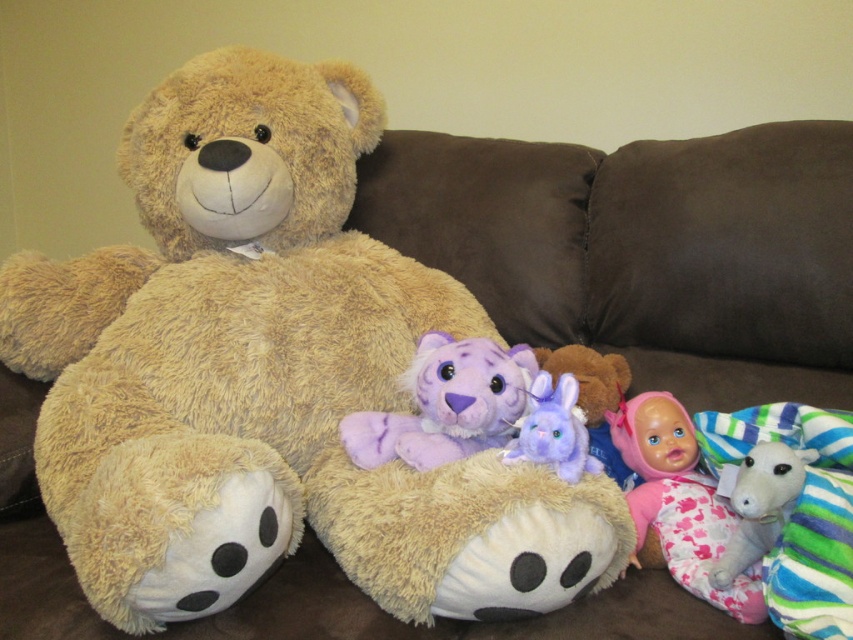
Question: Can you confirm if pink fabric doll at lower right is positioned to the right of white plush goat at lower right?

Choices:
 (A) yes
 (B) no

Answer: (B)

Question: Considering the relative positions of pink fabric doll at lower right and purple plush tiger at center in the image provided, where is pink fabric doll at lower right located with respect to purple plush tiger at center?

Choices:
 (A) above
 (B) below

Answer: (B)

Question: Is pink fabric doll at lower right wider than purple plush rabbit at center?

Choices:
 (A) no
 (B) yes

Answer: (B)

Question: Estimate the real-world distances between objects in this image. Which object is closer to the purple plush rabbit at center?

Choices:
 (A) white plush goat at lower right
 (B) purple plush tiger at center

Answer: (B)

Question: Which of these objects is positioned closest to the purple plush rabbit at center?

Choices:
 (A) purple plush tiger at center
 (B) pink fabric doll at lower right
 (C) white plush goat at lower right

Answer: (A)

Question: Considering the real-world distances, which object is closest to the purple plush tiger at center?

Choices:
 (A) pink fabric doll at lower right
 (B) white plush goat at lower right

Answer: (A)